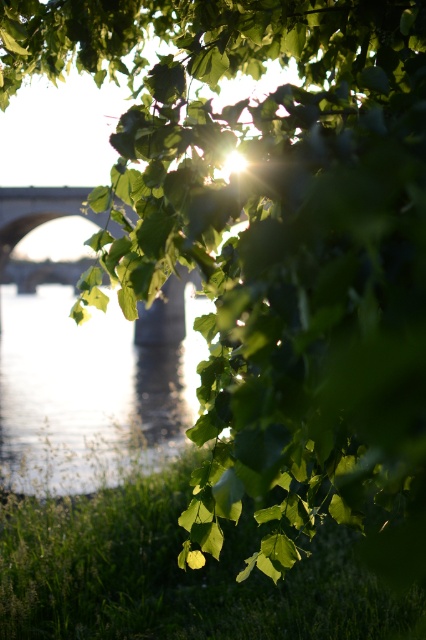
Question: Does green leafy grass at lower left lie behind clear water at center?

Choices:
 (A) no
 (B) yes

Answer: (B)

Question: Which point is farther to the camera?

Choices:
 (A) (22, 364)
 (B) (304, 634)

Answer: (A)

Question: Among these objects, which one is farthest from the camera?

Choices:
 (A) clear water at center
 (B) green leafy grass at lower left

Answer: (B)

Question: In this image, where is green leafy grass at lower left located relative to clear water at center?

Choices:
 (A) below
 (B) above

Answer: (A)

Question: Can you confirm if green leafy grass at lower left is thinner than clear water at center?

Choices:
 (A) no
 (B) yes

Answer: (B)